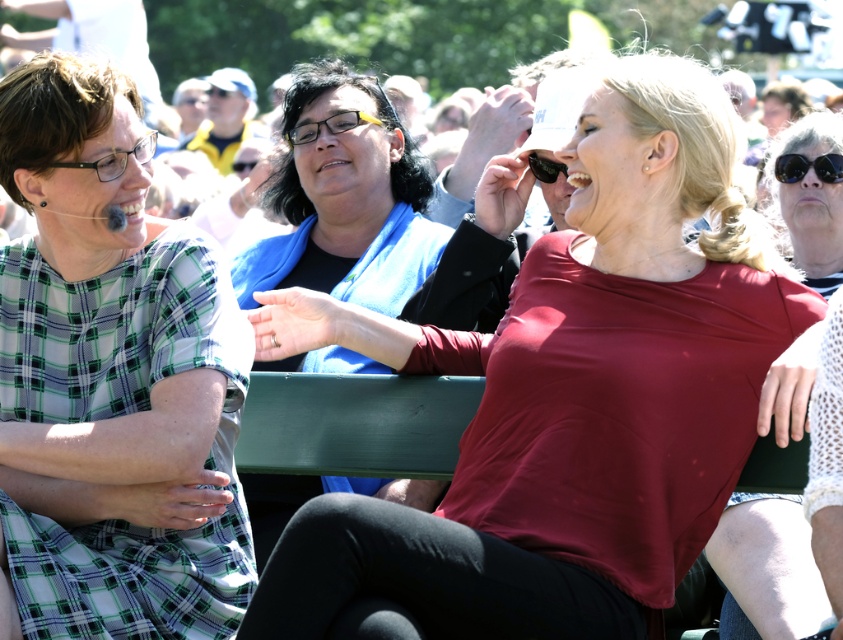
Question: Is matte red shirt at center positioned at the back of black reflective sunglasses at upper right?

Choices:
 (A) no
 (B) yes

Answer: (A)

Question: Based on their relative distances, which object is nearer to the black reflective sunglasses at upper right?

Choices:
 (A) matte white blouse at center
 (B) green plaid dress at left
 (C) black plastic goggles at upper center
 (D) matte black glasses at left

Answer: (C)

Question: Can you confirm if green plaid dress at left is thinner than black plastic goggles at upper center?

Choices:
 (A) no
 (B) yes

Answer: (A)

Question: Which of the following is the closest to the observer?

Choices:
 (A) matte white blouse at center
 (B) black plastic goggles at upper center

Answer: (A)

Question: Estimate the real-world distances between objects in this image. Which object is closer to the black reflective sunglasses at upper right?

Choices:
 (A) black plastic goggles at upper center
 (B) matte black glasses at left
 (C) green plaid dress at left
 (D) matte white blouse at center

Answer: (A)

Question: Is matte red shirt at center smaller than matte white blouse at center?

Choices:
 (A) no
 (B) yes

Answer: (A)